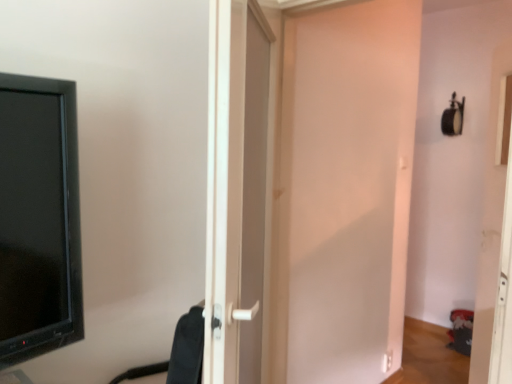
Locate an element on the screen. The image size is (512, 384). black fabric swivel chair at center is located at coordinates (178, 353).

Describe the element at coordinates (237, 191) in the screenshot. I see `white plastic door at center, which appears as the second door when viewed from the right` at that location.

Find the location of `black fabric swivel chair at center`. black fabric swivel chair at center is located at coordinates (178, 353).

Measure the distance from white matte door at center, the second door positioned from the left, to black fabric swivel chair at center.

1.50 meters.

Consider the image. Which of these two, white matte door at center, the second door positioned from the left, or black fabric swivel chair at center, stands shorter?

black fabric swivel chair at center.

Which is more to the right, white matte door at center, marked as the 1th door in a right-to-left arrangement, or black fabric swivel chair at center?

From the viewer's perspective, white matte door at center, marked as the 1th door in a right-to-left arrangement, appears more on the right side.

Considering their positions, is white matte door at center, the second door positioned from the left, located in front of or behind black fabric swivel chair at center?

white matte door at center, the second door positioned from the left, is positioned farther from the viewer than black fabric swivel chair at center.

From a real-world perspective, between black fabric swivel chair at center and white plastic door at center, which is the 1th door in left-to-right order, who is vertically lower?

black fabric swivel chair at center.

Between point (152, 370) and point (258, 328), which one is positioned in front?

The point (152, 370) is closer.

At what (x,y) coordinates should I click in order to perform the action: click on the 1st door to the right of the black fabric swivel chair at center, starting your count from the anchor. Please return your answer as a coordinate pair (x, y). Looking at the image, I should click on (237, 191).

Relative to white plastic door at center, which appears as the second door when viewed from the right, is black fabric swivel chair at center in front or behind?

Visually, black fabric swivel chair at center is located behind white plastic door at center, which appears as the second door when viewed from the right.

Is white plastic door at center, which appears as the second door when viewed from the right, oriented towards black fabric swivel chair at center?

No.

Can you tell me how much white plastic door at center, which appears as the second door when viewed from the right, and black fabric swivel chair at center differ in facing direction?

white plastic door at center, which appears as the second door when viewed from the right, and black fabric swivel chair at center are facing 31.6 degrees away from each other.

Between white plastic door at center, which appears as the second door when viewed from the right, and black fabric swivel chair at center, which one appears on the right side from the viewer's perspective?

white plastic door at center, which appears as the second door when viewed from the right, is more to the right.

Is black fabric swivel chair at center surrounded by white plastic door at center, which appears as the second door when viewed from the right?

Absolutely, black fabric swivel chair at center is inside white plastic door at center, which appears as the second door when viewed from the right.

Is black fabric swivel chair at center in front of white matte door at center, marked as the 1th door in a right-to-left arrangement?

Yes, black fabric swivel chair at center is closer to the viewer.

Based on the photo, between black fabric swivel chair at center and white matte door at center, marked as the 1th door in a right-to-left arrangement, which one has smaller width?

white matte door at center, marked as the 1th door in a right-to-left arrangement.

Consider the image. From the image's perspective, is black fabric swivel chair at center above or below white matte door at center, the second door positioned from the left?

From the image's perspective, black fabric swivel chair at center appears below white matte door at center, the second door positioned from the left.

Does black fabric swivel chair at center have a smaller size compared to white matte door at center, marked as the 1th door in a right-to-left arrangement?

Indeed, black fabric swivel chair at center has a smaller size compared to white matte door at center, marked as the 1th door in a right-to-left arrangement.

Is white plastic door at center, which appears as the second door when viewed from the right, bigger than white matte door at center, the second door positioned from the left?

Correct, white plastic door at center, which appears as the second door when viewed from the right, is larger in size than white matte door at center, the second door positioned from the left.

Is there a large distance between white plastic door at center, which is the 1th door in left-to-right order, and white matte door at center, the second door positioned from the left?

No, white plastic door at center, which is the 1th door in left-to-right order, is in close proximity to white matte door at center, the second door positioned from the left.

Considering the relative positions of white plastic door at center, which is the 1th door in left-to-right order, and white matte door at center, marked as the 1th door in a right-to-left arrangement, in the image provided, is white plastic door at center, which is the 1th door in left-to-right order, to the left or to the right of white matte door at center, marked as the 1th door in a right-to-left arrangement,?

Clearly, white plastic door at center, which is the 1th door in left-to-right order, is on the left of white matte door at center, marked as the 1th door in a right-to-left arrangement, in the image.

Looking at this image, which object is further away from the camera taking this photo, white plastic door at center, which appears as the second door when viewed from the right, or white matte door at center, marked as the 1th door in a right-to-left arrangement?

white matte door at center, marked as the 1th door in a right-to-left arrangement, is further from the camera.

Which of these two, white matte door at center, the second door positioned from the left, or white plastic door at center, which appears as the second door when viewed from the right, stands shorter?

With less height is white plastic door at center, which appears as the second door when viewed from the right.

Who is bigger, white matte door at center, marked as the 1th door in a right-to-left arrangement, or white plastic door at center, which is the 1th door in left-to-right order?

Bigger between the two is white plastic door at center, which is the 1th door in left-to-right order.

Looking at this image, how different are the orientations of white matte door at center, marked as the 1th door in a right-to-left arrangement, and white plastic door at center, which is the 1th door in left-to-right order, in degrees?

There is a 123-degree angle between the facing directions of white matte door at center, marked as the 1th door in a right-to-left arrangement, and white plastic door at center, which is the 1th door in left-to-right order.

Looking at this image, which object is closer to the camera taking this photo, white matte door at center, marked as the 1th door in a right-to-left arrangement, or white plastic door at center, which is the 1th door in left-to-right order?

white plastic door at center, which is the 1th door in left-to-right order.

Where is `swivel chair lying in front of the white matte door at center, marked as the 1th door in a right-to-left arrangement`? The width and height of the screenshot is (512, 384). swivel chair lying in front of the white matte door at center, marked as the 1th door in a right-to-left arrangement is located at coordinates (178, 353).

In the image, there is a white plastic door at center, which appears as the second door when viewed from the right. Identify the location of swivel chair below it (from the image's perspective). The width and height of the screenshot is (512, 384). (178, 353).

Estimate the real-world distances between objects in this image. Which object is further from black fabric swivel chair at center, white plastic door at center, which appears as the second door when viewed from the right, or white matte door at center, marked as the 1th door in a right-to-left arrangement?

white matte door at center, marked as the 1th door in a right-to-left arrangement, is further to black fabric swivel chair at center.

When comparing their distances from white plastic door at center, which is the 1th door in left-to-right order, does black fabric swivel chair at center or white matte door at center, marked as the 1th door in a right-to-left arrangement, seem closer?

Based on the image, black fabric swivel chair at center appears to be nearer to white plastic door at center, which is the 1th door in left-to-right order.

When comparing their distances from black fabric swivel chair at center, does white matte door at center, the second door positioned from the left, or white plastic door at center, which is the 1th door in left-to-right order, seem further?

white matte door at center, the second door positioned from the left, is further to black fabric swivel chair at center.

In the scene shown: Considering their positions, is white plastic door at center, which is the 1th door in left-to-right order, positioned further to white matte door at center, the second door positioned from the left, than black fabric swivel chair at center?

black fabric swivel chair at center lies further to white matte door at center, the second door positioned from the left, than the other object.

Considering their positions, is black fabric swivel chair at center positioned closer to white matte door at center, the second door positioned from the left, than white plastic door at center, which is the 1th door in left-to-right order?

The object closer to white matte door at center, the second door positioned from the left, is white plastic door at center, which is the 1th door in left-to-right order.

Looking at the image, which one is located closer to white plastic door at center, which is the 1th door in left-to-right order, white matte door at center, the second door positioned from the left, or black fabric swivel chair at center?

black fabric swivel chair at center.

Where is `door between black fabric swivel chair at center and white matte door at center, marked as the 1th door in a right-to-left arrangement`? This screenshot has height=384, width=512. door between black fabric swivel chair at center and white matte door at center, marked as the 1th door in a right-to-left arrangement is located at coordinates (x=237, y=191).